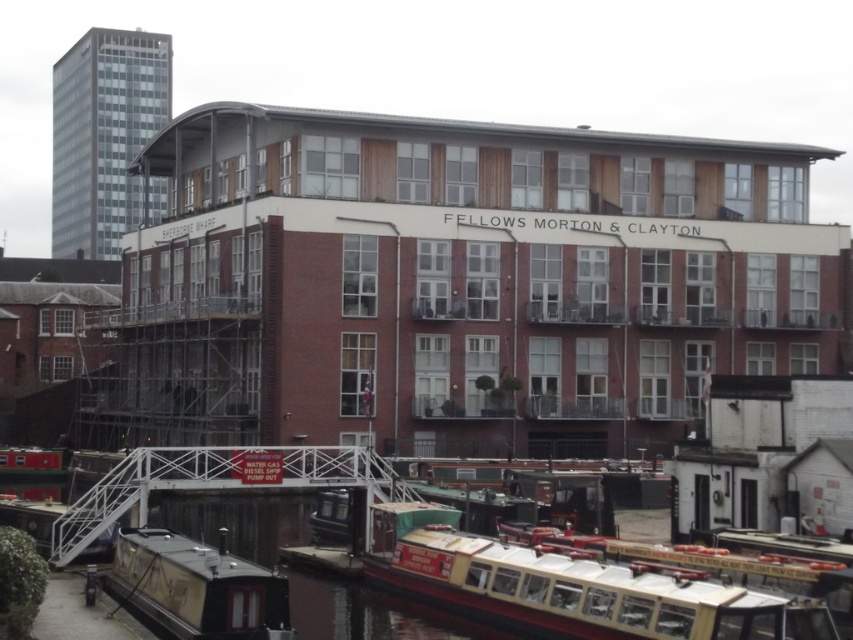
Who is more forward, (701,592) or (148,589)?

Point (701,592) is more forward.

Locate an element on the screen. The width and height of the screenshot is (853, 640). white wooden boat at lower center is located at coordinates (570, 592).

I want to click on white wooden boat at lower center, so click(570, 592).